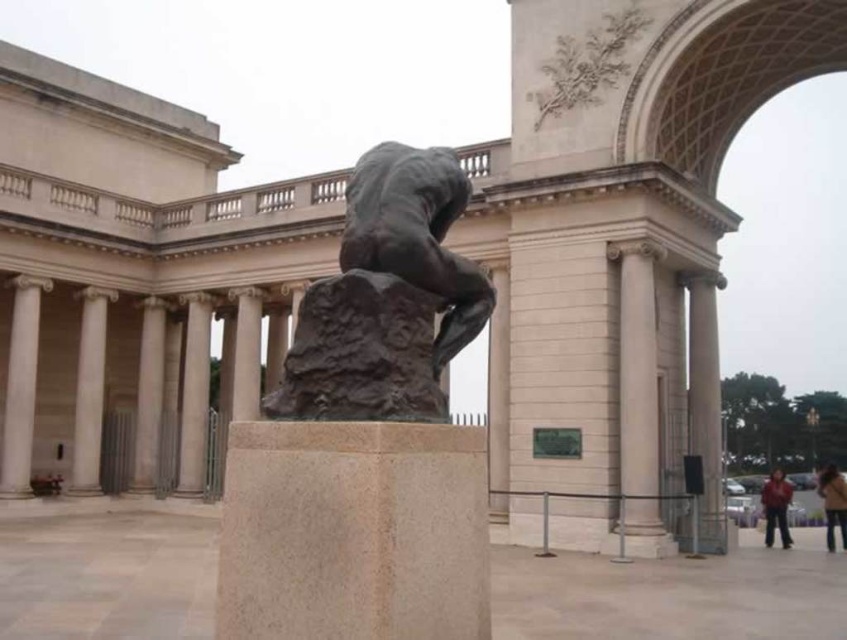
Is point (446, 262) closer to viewer compared to point (821, 492)?

Yes, it is in front of point (821, 492).

Is point (383, 371) in front of point (845, 499)?

Yes, point (383, 371) is in front of point (845, 499).

In order to click on bronze statue at center in this screenshot , I will do `click(386, 298)`.

Is smooth gray column at center smaller than brown leather jacket at lower right?

Yes, smooth gray column at center is smaller than brown leather jacket at lower right.

Between smooth gray column at center and brown leather jacket at lower right, which one is positioned higher?

smooth gray column at center

Is point (187, 339) positioned after point (836, 518)?

That is True.

Identify the location of smooth gray column at center. This screenshot has width=847, height=640. (194, 394).

Who is shorter, white marble column at center or white marble pillar at left?

white marble column at center is shorter.

Is white marble column at center below white marble pillar at left?

No, white marble column at center is not below white marble pillar at left.

What are the coordinates of `white marble column at center` in the screenshot? It's located at (638, 401).